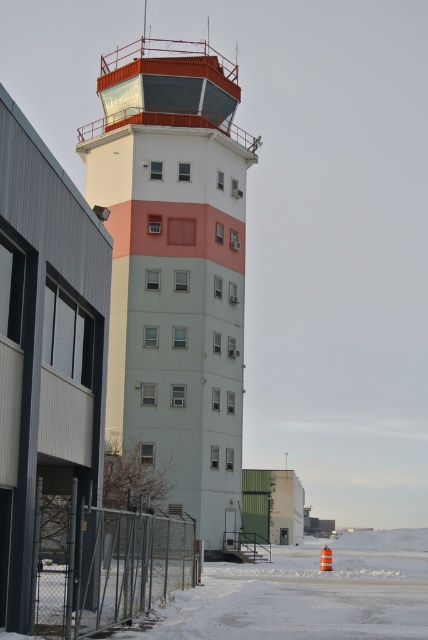
Question: Is white painted concrete control tower at center below metal chain-link fence at lower left?

Choices:
 (A) yes
 (B) no

Answer: (B)

Question: Which object is closer to the camera taking this photo?

Choices:
 (A) white painted concrete control tower at center
 (B) metal chain-link fence at lower left

Answer: (B)

Question: Can you confirm if white painted concrete control tower at center is positioned to the right of metal chain-link fence at lower left?

Choices:
 (A) no
 (B) yes

Answer: (A)

Question: Is white painted concrete control tower at center to the left of metal chain-link fence at lower left from the viewer's perspective?

Choices:
 (A) no
 (B) yes

Answer: (B)